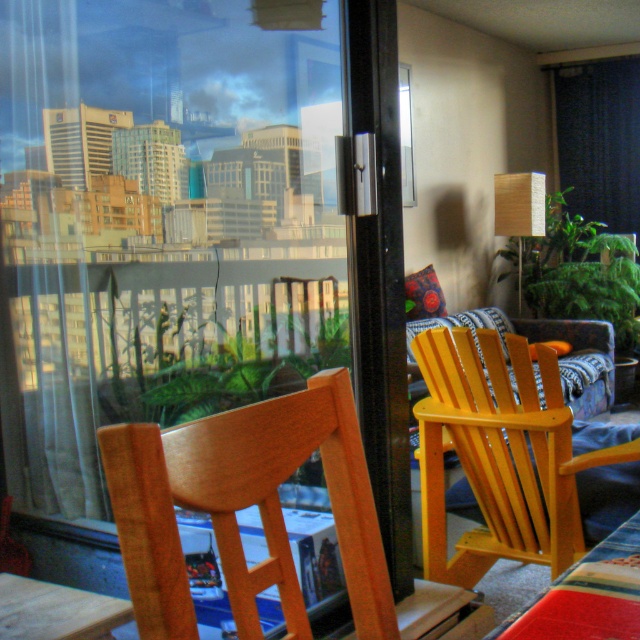
You are standing in the room and want to sit in the yellow wood chair at right. If your legs are 0.9 meters long, will your feet touch the ground when sitting?

The yellow wood chair at right is 1.90 meters away from you. However, the distance between you and the chair does not determine if your feet will touch the ground when sitting. The height of the chair is needed to determine this, which is not provided in the scene description. Therefore, it cannot be determined.

You are a delivery person with a package that is 5 feet long. You need to carry it through the space between the transparent glass door at upper center and the wooden table at lower right. Will the package fit through that space?

The transparent glass door at upper center and wooden table at lower right are 5.37 feet apart. Since the package is 5 feet long, it will fit through the space between them as the distance is sufficient.

You are a guest entering the room and want to sit down. You see the yellow wood chair at right and the wooden table at lower right. Which object should you approach first to sit comfortably?

You should approach the yellow wood chair at right first because it is positioned under the wooden table at lower right, making it the appropriate seating spot.